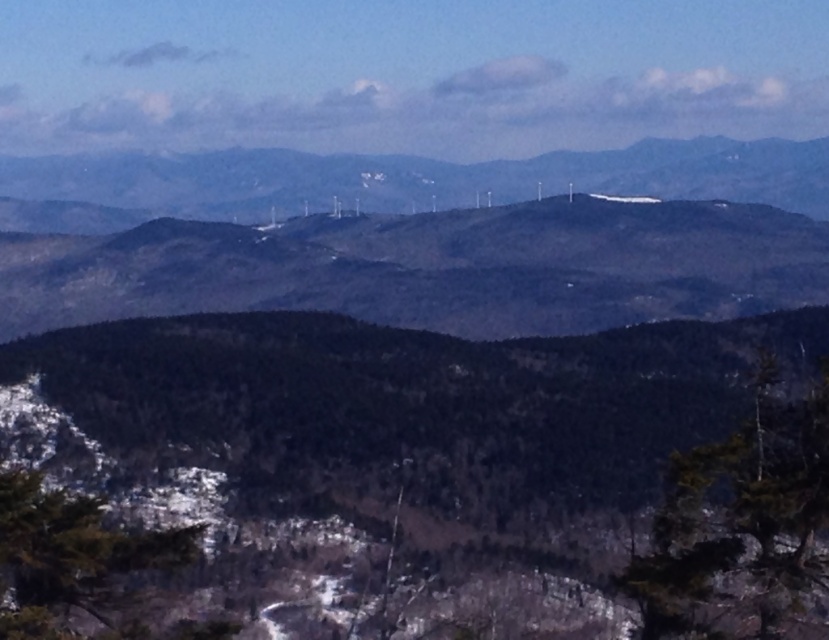
Question: In this image, where is green matte tree at center located relative to green textured tree at lower right?

Choices:
 (A) above
 (B) below

Answer: (B)

Question: Which point is farther from the camera taking this photo?

Choices:
 (A) (308, 328)
 (B) (774, 586)

Answer: (A)

Question: Which object appears farthest from the camera in this image?

Choices:
 (A) green textured tree at lower right
 (B) green matte tree at center

Answer: (B)

Question: Can you confirm if green matte tree at center is wider than green textured tree at lower right?

Choices:
 (A) yes
 (B) no

Answer: (A)

Question: Can you confirm if green matte tree at center is positioned to the left of green textured tree at lower right?

Choices:
 (A) no
 (B) yes

Answer: (B)